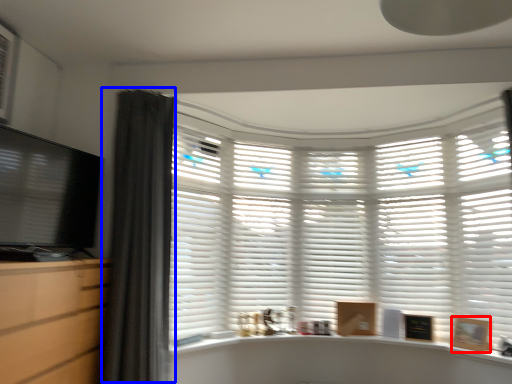
Question: Among these objects, which one is nearest to the camera, picture frame (highlighted by a red box) or curtain (highlighted by a blue box)?

Choices:
 (A) picture frame
 (B) curtain

Answer: (B)